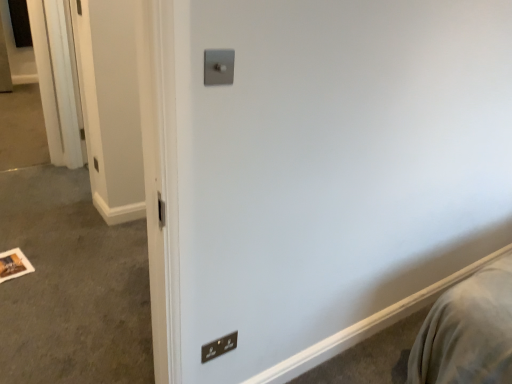
How much space does satin silver switch at upper center, marked as the first light switch in a top-to-bottom arrangement, occupy horizontally?

The width of satin silver switch at upper center, marked as the first light switch in a top-to-bottom arrangement, is 1.41 inches.

Measure the distance between satin silver switch at upper center, marked as the first light switch in a top-to-bottom arrangement, and camera.

The depth of satin silver switch at upper center, marked as the first light switch in a top-to-bottom arrangement, is 3.51 feet.

You are a GUI agent. You are given a task and a screenshot of the screen. Output one action in this format:
    pyautogui.click(x=<x>, y=<y>)
    Task: Click on the satin silver switch at upper center, marked as the first light switch in a top-to-bottom arrangement
    
    Given the screenshot: What is the action you would take?
    pyautogui.click(x=218, y=67)

The image size is (512, 384). What do you see at coordinates (218, 67) in the screenshot?
I see `satin silver switch at upper center, the first light switch positioned from the front` at bounding box center [218, 67].

In order to face black plastic light switch at lower center, positioned as the 1th light switch in bottom-to-top order, should I rotate leftwards or rightwards?

A 4.649 degree turn to the left will do.

I want to click on black plastic light switch at lower center, positioned as the 1th light switch in bottom-to-top order, so click(x=219, y=347).

The height and width of the screenshot is (384, 512). What do you see at coordinates (219, 347) in the screenshot?
I see `black plastic light switch at lower center, the 2th light switch in the front-to-back sequence` at bounding box center [219, 347].

In order to click on satin silver switch at upper center, arranged as the 2th light switch when viewed from the back in this screenshot , I will do `click(218, 67)`.

Which object is positioned more to the right, black plastic light switch at lower center, the 2th light switch in the front-to-back sequence, or satin silver switch at upper center, the first light switch positioned from the front?

Positioned to the right is satin silver switch at upper center, the first light switch positioned from the front.

Is black plastic light switch at lower center, marked as the first light switch in a back-to-front arrangement, in front of or behind satin silver switch at upper center, the first light switch positioned from the front, in the image?

Clearly, black plastic light switch at lower center, marked as the first light switch in a back-to-front arrangement, is behind satin silver switch at upper center, the first light switch positioned from the front.

Is point (208, 343) closer to viewer compared to point (211, 82)?

No.

From the image's perspective, is black plastic light switch at lower center, marked as the first light switch in a back-to-front arrangement, located beneath satin silver switch at upper center, arranged as the 2th light switch when viewed from the back?

Yes.

From a real-world perspective, is black plastic light switch at lower center, marked as the first light switch in a back-to-front arrangement, above or below satin silver switch at upper center, arranged as the 2th light switch when viewed from the back?

Clearly, from a real-world perspective, black plastic light switch at lower center, marked as the first light switch in a back-to-front arrangement, is below satin silver switch at upper center, arranged as the 2th light switch when viewed from the back.

Which object is thinner, black plastic light switch at lower center, positioned as the 1th light switch in bottom-to-top order, or satin silver switch at upper center, which ranks as the second light switch in bottom-to-top order?

black plastic light switch at lower center, positioned as the 1th light switch in bottom-to-top order.

Between black plastic light switch at lower center, positioned as the 1th light switch in bottom-to-top order, and satin silver switch at upper center, marked as the first light switch in a top-to-bottom arrangement, which one has less height?

Standing shorter between the two is satin silver switch at upper center, marked as the first light switch in a top-to-bottom arrangement.

Considering the sizes of objects black plastic light switch at lower center, the 2th light switch in the front-to-back sequence, and satin silver switch at upper center, marked as the first light switch in a top-to-bottom arrangement, in the image provided, who is smaller, black plastic light switch at lower center, the 2th light switch in the front-to-back sequence, or satin silver switch at upper center, marked as the first light switch in a top-to-bottom arrangement,?

black plastic light switch at lower center, the 2th light switch in the front-to-back sequence.

Is black plastic light switch at lower center, the 2th light switch in the front-to-back sequence, inside the boundaries of satin silver switch at upper center, which ranks as the second light switch in bottom-to-top order, or outside?

The correct answer is: outside.

Are black plastic light switch at lower center, placed as the 2th light switch when sorted from top to bottom, and satin silver switch at upper center, which ranks as the second light switch in bottom-to-top order, making contact?

No, black plastic light switch at lower center, placed as the 2th light switch when sorted from top to bottom, is not next to satin silver switch at upper center, which ranks as the second light switch in bottom-to-top order.

Is black plastic light switch at lower center, marked as the first light switch in a back-to-front arrangement, oriented away from satin silver switch at upper center, marked as the first light switch in a top-to-bottom arrangement?

black plastic light switch at lower center, marked as the first light switch in a back-to-front arrangement, does not have its back to satin silver switch at upper center, marked as the first light switch in a top-to-bottom arrangement.

How different are the orientations of black plastic light switch at lower center, the 2th light switch in the front-to-back sequence, and satin silver switch at upper center, the first light switch positioned from the front, in degrees?

The angle between the facing direction of black plastic light switch at lower center, the 2th light switch in the front-to-back sequence, and the facing direction of satin silver switch at upper center, the first light switch positioned from the front, is 3.27 degrees.

Locate an element on the screen. The width and height of the screenshot is (512, 384). light switch that appears behind the satin silver switch at upper center, which ranks as the second light switch in bottom-to-top order is located at coordinates (219, 347).

Which is more to the left, satin silver switch at upper center, which ranks as the second light switch in bottom-to-top order, or black plastic light switch at lower center, the 2th light switch in the front-to-back sequence?

From the viewer's perspective, black plastic light switch at lower center, the 2th light switch in the front-to-back sequence, appears more on the left side.

Considering the relative positions of satin silver switch at upper center, which ranks as the second light switch in bottom-to-top order, and black plastic light switch at lower center, placed as the 2th light switch when sorted from top to bottom, in the image provided, is satin silver switch at upper center, which ranks as the second light switch in bottom-to-top order, behind black plastic light switch at lower center, placed as the 2th light switch when sorted from top to bottom,?

No, satin silver switch at upper center, which ranks as the second light switch in bottom-to-top order, is closer to the camera.

Is point (228, 74) closer to viewer compared to point (219, 343)?

Yes, it is in front of point (219, 343).

From the image's perspective, relative to black plastic light switch at lower center, positioned as the 1th light switch in bottom-to-top order, is satin silver switch at upper center, the first light switch positioned from the front, above or below?

From the image's perspective, satin silver switch at upper center, the first light switch positioned from the front, appears above black plastic light switch at lower center, positioned as the 1th light switch in bottom-to-top order.

From a real-world perspective, does satin silver switch at upper center, marked as the first light switch in a top-to-bottom arrangement, stand above black plastic light switch at lower center, the 2th light switch in the front-to-back sequence?

Correct, in the physical world, satin silver switch at upper center, marked as the first light switch in a top-to-bottom arrangement, is higher than black plastic light switch at lower center, the 2th light switch in the front-to-back sequence.

Considering the sizes of satin silver switch at upper center, the first light switch positioned from the front, and black plastic light switch at lower center, marked as the first light switch in a back-to-front arrangement, in the image, is satin silver switch at upper center, the first light switch positioned from the front, wider or thinner than black plastic light switch at lower center, marked as the first light switch in a back-to-front arrangement,?

In the image, satin silver switch at upper center, the first light switch positioned from the front, appears to be wider than black plastic light switch at lower center, marked as the first light switch in a back-to-front arrangement.

Considering the relative sizes of satin silver switch at upper center, the first light switch positioned from the front, and black plastic light switch at lower center, positioned as the 1th light switch in bottom-to-top order, in the image provided, is satin silver switch at upper center, the first light switch positioned from the front, taller than black plastic light switch at lower center, positioned as the 1th light switch in bottom-to-top order,?

No.

Consider the image. Can you confirm if satin silver switch at upper center, arranged as the 2th light switch when viewed from the back, is smaller than black plastic light switch at lower center, positioned as the 1th light switch in bottom-to-top order?

Actually, satin silver switch at upper center, arranged as the 2th light switch when viewed from the back, might be larger than black plastic light switch at lower center, positioned as the 1th light switch in bottom-to-top order.

Is satin silver switch at upper center, the first light switch positioned from the front, completely or partially outside of black plastic light switch at lower center, marked as the first light switch in a back-to-front arrangement?

Yes, satin silver switch at upper center, the first light switch positioned from the front, is not within black plastic light switch at lower center, marked as the first light switch in a back-to-front arrangement.

Looking at this image, are satin silver switch at upper center, the first light switch positioned from the front, and black plastic light switch at lower center, placed as the 2th light switch when sorted from top to bottom, making contact?

No, satin silver switch at upper center, the first light switch positioned from the front, is not next to black plastic light switch at lower center, placed as the 2th light switch when sorted from top to bottom.

Is satin silver switch at upper center, the first light switch positioned from the front, facing towards black plastic light switch at lower center, the 2th light switch in the front-to-back sequence?

No, satin silver switch at upper center, the first light switch positioned from the front, is not facing towards black plastic light switch at lower center, the 2th light switch in the front-to-back sequence.

Measure the distance from satin silver switch at upper center, the first light switch positioned from the front, to black plastic light switch at lower center, placed as the 2th light switch when sorted from top to bottom.

A distance of 38.55 inches exists between satin silver switch at upper center, the first light switch positioned from the front, and black plastic light switch at lower center, placed as the 2th light switch when sorted from top to bottom.

Find the location of a particular element. Image resolution: width=512 pixels, height=384 pixels. light switch in front of the black plastic light switch at lower center, placed as the 2th light switch when sorted from top to bottom is located at coordinates (218, 67).

Find the location of a particular element. The height and width of the screenshot is (384, 512). light switch that is in front of the black plastic light switch at lower center, the 2th light switch in the front-to-back sequence is located at coordinates (218, 67).

At what (x,y) coordinates should I click in order to perform the action: click on light switch behind the satin silver switch at upper center, marked as the first light switch in a top-to-bottom arrangement. Please return your answer as a coordinate pair (x, y). The image size is (512, 384). Looking at the image, I should click on (219, 347).